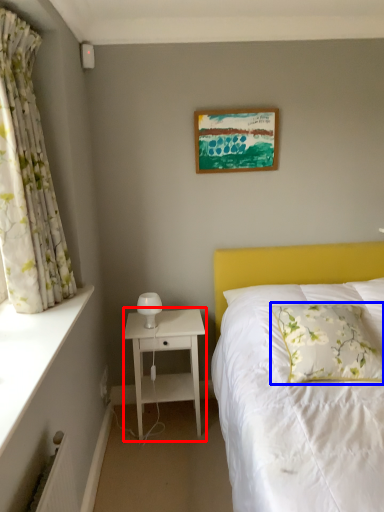
Question: Which of the following is the farthest to the observer, nightstand (highlighted by a red box) or pillow (highlighted by a blue box)?

Choices:
 (A) nightstand
 (B) pillow

Answer: (A)